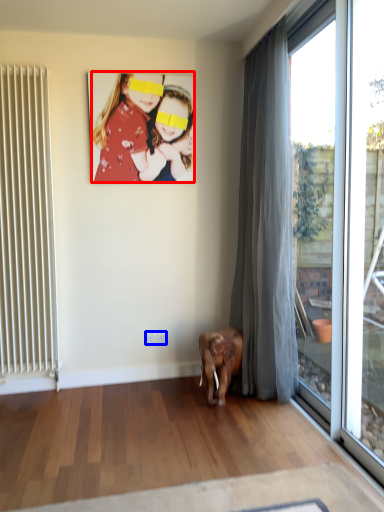
Question: Which point is further to the camera, person (highlighted by a red box) or power outlet (highlighted by a blue box)?

Choices:
 (A) person
 (B) power outlet

Answer: (B)